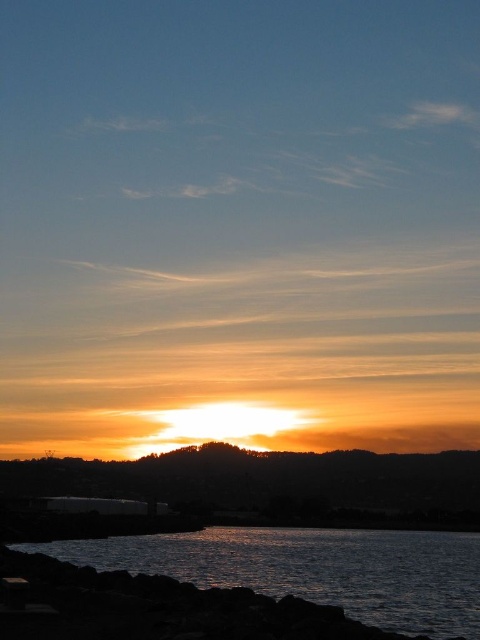
You are standing on the rocky shoreline observing the sunset. The golden sky at center is represented by point (275, 484). Where would you look to see the golden sky at center?

The golden sky at center is located at the coordinates point (275, 484).

You are an artist trying to paint the sunset scene. You notice the golden sky at center and the dark reflective water at lower left. Which object appears taller in the painting?

The dark reflective water at lower left appears taller than the golden sky at center in the painting.